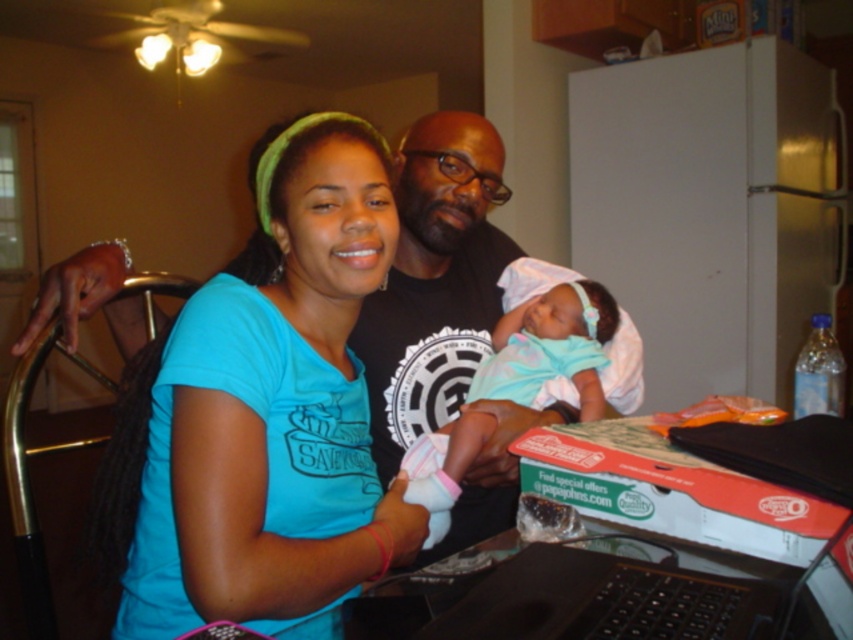
Is matte blue shirt at center to the left of cardboard pizza box at lower right from the viewer's perspective?

Yes, matte blue shirt at center is to the left of cardboard pizza box at lower right.

Who is positioned more to the right, matte blue shirt at center or cardboard pizza box at lower right?

cardboard pizza box at lower right is more to the right.

Locate an element on the screen. This screenshot has width=853, height=640. matte blue shirt at center is located at coordinates (265, 410).

Find the location of a particular element. The height and width of the screenshot is (640, 853). matte blue shirt at center is located at coordinates (265, 410).

Is cardboard pizza box at lower right thinner than light blue fabric at center?

Yes, cardboard pizza box at lower right is thinner than light blue fabric at center.

Does point (665, 518) lie in front of point (424, 545)?

Yes, point (665, 518) is closer to viewer.

Is point (653, 493) farther from viewer compared to point (537, 353)?

No, it is not.

Image resolution: width=853 pixels, height=640 pixels. I want to click on cardboard pizza box at lower right, so click(x=671, y=490).

Does matte blue shirt at center have a smaller size compared to light blue fabric at center?

No, matte blue shirt at center is not smaller than light blue fabric at center.

Can you confirm if matte blue shirt at center is positioned to the right of light blue fabric at center?

In fact, matte blue shirt at center is to the left of light blue fabric at center.

The image size is (853, 640). What do you see at coordinates (265, 410) in the screenshot? I see `matte blue shirt at center` at bounding box center [265, 410].

Locate an element on the screen. Image resolution: width=853 pixels, height=640 pixels. matte blue shirt at center is located at coordinates (265, 410).